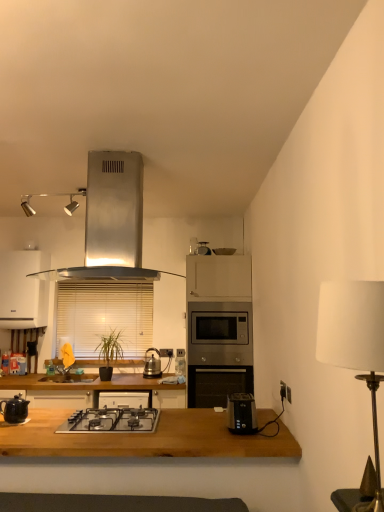
Image resolution: width=384 pixels, height=512 pixels. What do you see at coordinates (283, 390) in the screenshot?
I see `black plastic electric outlet at right, the 2th electric outlet from the back` at bounding box center [283, 390].

What is the approximate width of black plastic electric outlet at right, which appears as the second electric outlet when viewed from the top?

0.87 inches.

Identify the location of stainless steel gas stove at center. (111, 420).

The height and width of the screenshot is (512, 384). Find the location of `matte black kettle at left, placed as the second kitchen appliance when sorted from top to bottom`. matte black kettle at left, placed as the second kitchen appliance when sorted from top to bottom is located at coordinates (14, 409).

What is the approximate height of white fabric lampshade at right?

It is 21.30 inches.

This screenshot has height=512, width=384. Identify the location of white fabric lampshade at right. (354, 339).

In order to face stainless steel oven at center, the second oven positioned from the top, should I rotate leftwards or rightwards?

Rotate your view right by about 3.486°.

Find the location of a particular element. Image resolution: width=384 pixels, height=512 pixels. black plastic electric outlet at right, the third electric outlet from the left is located at coordinates (283, 390).

Considering the sizes of objects white matte cabinet at upper left and wooden blinds at center in the image provided, who is smaller, white matte cabinet at upper left or wooden blinds at center?

wooden blinds at center.

Which is in front, white matte cabinet at upper left or wooden blinds at center?

Positioned in front is white matte cabinet at upper left.

In terms of height, does white matte cabinet at upper left look taller or shorter compared to wooden blinds at center?

white matte cabinet at upper left is shorter than wooden blinds at center.

Does white matte cabinet at upper left turn towards wooden blinds at center?

No, white matte cabinet at upper left is not turned towards wooden blinds at center.

Which point is more forward, [192,303] or [251,425]?

The point [251,425] is closer to the camera.

Considering the relative sizes of satin silver microwave at center, the 1th oven when ordered from top to bottom, and black plastic toaster at lower center in the image provided, is satin silver microwave at center, the 1th oven when ordered from top to bottom, shorter than black plastic toaster at lower center?

Incorrect, the height of satin silver microwave at center, the 1th oven when ordered from top to bottom, does not fall short of that of black plastic toaster at lower center.

From a real-world perspective, which is physically above, satin silver microwave at center, the second oven positioned from the bottom, or black plastic toaster at lower center?

From a 3D spatial view, satin silver microwave at center, the second oven positioned from the bottom, is above.

Based on the photo, can you confirm if satin silver microwave at center, the second oven positioned from the bottom, is positioned to the left of black plastic toaster at lower center?

Correct, you'll find satin silver microwave at center, the second oven positioned from the bottom, to the left of black plastic toaster at lower center.

From the image's perspective, between wooden table at center and black plastic toaster at lower center, who is located below?

wooden table at center.

Consider the image. Visually, is wooden table at center positioned to the left or to the right of black plastic toaster at lower center?

From the image, it's evident that wooden table at center is to the left of black plastic toaster at lower center.

Based on the photo, is wooden table at center positioned far away from black plastic toaster at lower center?

No, wooden table at center is not far from black plastic toaster at lower center.

Which of these two, wooden table at center or black plastic toaster at lower center, stands shorter?

With less height is black plastic toaster at lower center.

Considering the relative sizes of matte black toaster at lower right, positioned as the first electric outlet in front-to-back order, and wooden blinds at center in the image provided, is matte black toaster at lower right, positioned as the first electric outlet in front-to-back order, shorter than wooden blinds at center?

Indeed, matte black toaster at lower right, positioned as the first electric outlet in front-to-back order, has a lesser height compared to wooden blinds at center.

Is matte black toaster at lower right, the 2th electric outlet from the left, next to wooden blinds at center and touching it?

No, matte black toaster at lower right, the 2th electric outlet from the left, is not making contact with wooden blinds at center.

From the image's perspective, is matte black toaster at lower right, which ranks as the first electric outlet in top-to-bottom order, positioned above or below wooden blinds at center?

From the image's perspective, matte black toaster at lower right, which ranks as the first electric outlet in top-to-bottom order, appears below wooden blinds at center.

Looking at this image, who is smaller, matte black toaster at lower right, which ranks as the first electric outlet in top-to-bottom order, or wooden blinds at center?

With smaller size is matte black toaster at lower right, which ranks as the first electric outlet in top-to-bottom order.

The image size is (384, 512). Find the location of `gas stove in front of the brown wooden countertop at center`. gas stove in front of the brown wooden countertop at center is located at coordinates (111, 420).

From a real-world perspective, which object rests below the other?

brown wooden countertop at center, from a real-world perspective.

Considering the sizes of stainless steel gas stove at center and brown wooden countertop at center in the image, is stainless steel gas stove at center bigger or smaller than brown wooden countertop at center?

stainless steel gas stove at center is smaller than brown wooden countertop at center.

Is wooden blinds at center aimed at metallic silver scale at upper center?

No.

Is wooden blinds at center at the left side of metallic silver scale at upper center?

Indeed, wooden blinds at center is positioned on the left side of metallic silver scale at upper center.

Between wooden blinds at center and metallic silver scale at upper center, which one has larger width?

Wider between the two is metallic silver scale at upper center.

From a real-world perspective, which is physically below, wooden blinds at center or metallic silver scale at upper center?

From a 3D spatial view, wooden blinds at center is below.

Can you confirm if matte black toaster at lower right, which ranks as the first electric outlet in top-to-bottom order, is positioned to the right of stainless steel range hood at upper center, marked as the second kitchen appliance in a left-to-right arrangement?

Indeed, matte black toaster at lower right, which ranks as the first electric outlet in top-to-bottom order, is positioned on the right side of stainless steel range hood at upper center, marked as the second kitchen appliance in a left-to-right arrangement.

Can you confirm if matte black toaster at lower right, the 2th electric outlet from the right, is wider than stainless steel range hood at upper center, which appears as the third kitchen appliance when ordered from the bottom?

No.

From the image's perspective, does matte black toaster at lower right, positioned as the third electric outlet in bottom-to-top order, appear higher than stainless steel range hood at upper center, which appears as the third kitchen appliance when ordered from the bottom?

Incorrect, from the image's perspective, matte black toaster at lower right, positioned as the third electric outlet in bottom-to-top order, is lower than stainless steel range hood at upper center, which appears as the third kitchen appliance when ordered from the bottom.

Is matte black toaster at lower right, the 2th electric outlet from the right, facing towards stainless steel range hood at upper center, arranged as the first kitchen appliance when viewed from the top?

No.

The width and height of the screenshot is (384, 512). What are the coordinates of `cabinetry positioned vertically above the wooden blinds at center (from a real-world perspective)` in the screenshot? It's located at (23, 290).

What are the coordinates of `toaster on the right of satin silver microwave at center, the 1th oven when ordered from top to bottom` in the screenshot? It's located at (241, 413).

Which object lies further to the anchor point stainless steel range hood at upper center, acting as the 2th kitchen appliance starting from the right, brown wooden countertop at center or stainless steel gas stove at center?

brown wooden countertop at center is positioned further to the anchor stainless steel range hood at upper center, acting as the 2th kitchen appliance starting from the right.

In the scene shown: When comparing their distances from shiny metallic kettle at center, which ranks as the 3th kitchen appliance in front-to-back order, does wooden table at center or black plastic toaster at lower center seem further?

Based on the image, wooden table at center appears to be further to shiny metallic kettle at center, which ranks as the 3th kitchen appliance in front-to-back order.

Estimate the real-world distances between objects in this image. Which object is further from metallic silver scale at upper center, stainless steel range hood at upper center, positioned as the third kitchen appliance in back-to-front order, or white matte cabinet at upper left?

white matte cabinet at upper left.

From the image, which object appears to be farther from satin silver microwave at center, the 1th oven when ordered from top to bottom, white matte cabinet at upper left or brown wooden countertop at center?

white matte cabinet at upper left is further to satin silver microwave at center, the 1th oven when ordered from top to bottom.

When comparing their distances from stainless steel oven at center, the 1th oven ordered from the bottom, does wooden blinds at center or metallic silver scale at upper center seem further?

Based on the image, wooden blinds at center appears to be further to stainless steel oven at center, the 1th oven ordered from the bottom.

Considering their positions, is brown wooden countertop at center positioned further to black plastic toaster at lower center than wooden blinds at center?

wooden blinds at center is further to black plastic toaster at lower center.

Considering their positions, is wooden table at center positioned further to metallic silver scale at upper center than black plastic electric outlet at right, which ranks as the first electric outlet in right-to-left order?

wooden table at center is positioned further to the anchor metallic silver scale at upper center.

Looking at the image, which one is located further to white fabric lampshade at right, brown wooden countertop at center or black plastic electric outlet at right, which appears as the second electric outlet when viewed from the top?

brown wooden countertop at center.

Find the location of a particular element. table between white fabric lampshade at right and white matte cabinet at upper left in the front-back direction is located at coordinates (149, 459).

At what (x,y) coordinates should I click in order to perform the action: click on countertop positioned between white fabric lampshade at right and satin silver microwave at center, the 1th oven when ordered from top to bottom, from near to far. Please return your answer as a coordinate pair (x, y). The height and width of the screenshot is (512, 384). Looking at the image, I should click on [x=104, y=387].

Locate an element on the screen. The width and height of the screenshot is (384, 512). countertop between wooden table at center and shiny metallic kettle at center, the third kitchen appliance when ordered from top to bottom, from front to back is located at coordinates (104, 387).

Identify the location of countertop positioned between white fabric lampshade at right and white matte cabinet at upper left from near to far. (104, 387).